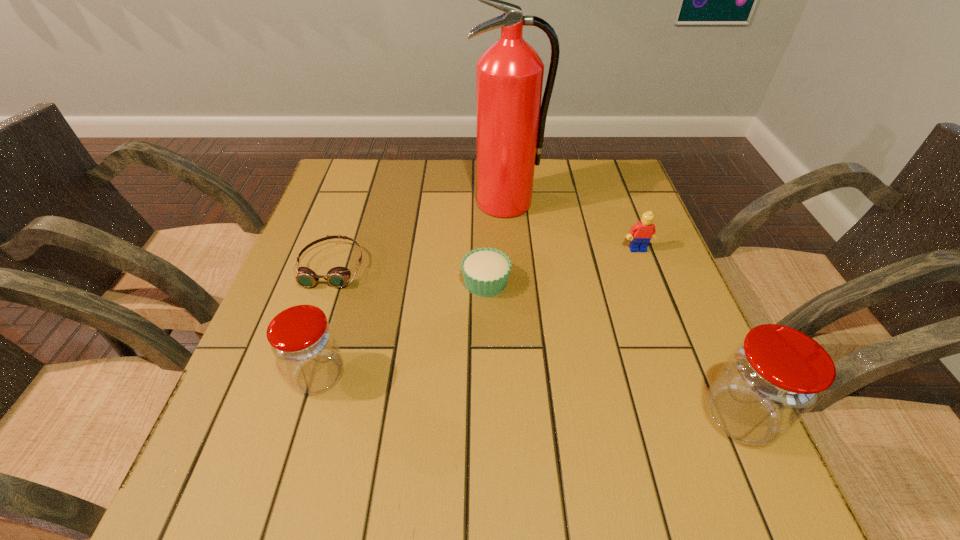
Locate an element on the screen. vacant point located 0.360m on the back of the taller jar is located at coordinates (667, 254).

Where is `free spot located at the nozzle of the farthest object`? The width and height of the screenshot is (960, 540). free spot located at the nozzle of the farthest object is located at coordinates (514, 303).

This screenshot has width=960, height=540. What are the coordinates of `free point located 0.230m on the face of the Lego` in the screenshot? It's located at pyautogui.click(x=667, y=327).

In order to click on free space located through the lenses of the goggles in this screenshot , I will do `click(309, 332)`.

Where is `vacant space located 0.230m on the left of the cupcake`? Image resolution: width=960 pixels, height=540 pixels. vacant space located 0.230m on the left of the cupcake is located at coordinates (360, 282).

Find the location of `object that is positioned at the far edge`. object that is positioned at the far edge is located at coordinates (510, 119).

Find the location of a particular element. The image size is (960, 540). jar that is positioned at the left edge is located at coordinates (302, 340).

Locate an element on the screen. goggles positioned at the left edge is located at coordinates (337, 277).

Where is `jar that is at the right edge`? This screenshot has height=540, width=960. jar that is at the right edge is located at coordinates (772, 379).

Locate an element on the screen. The image size is (960, 540). Lego at the right edge is located at coordinates (644, 230).